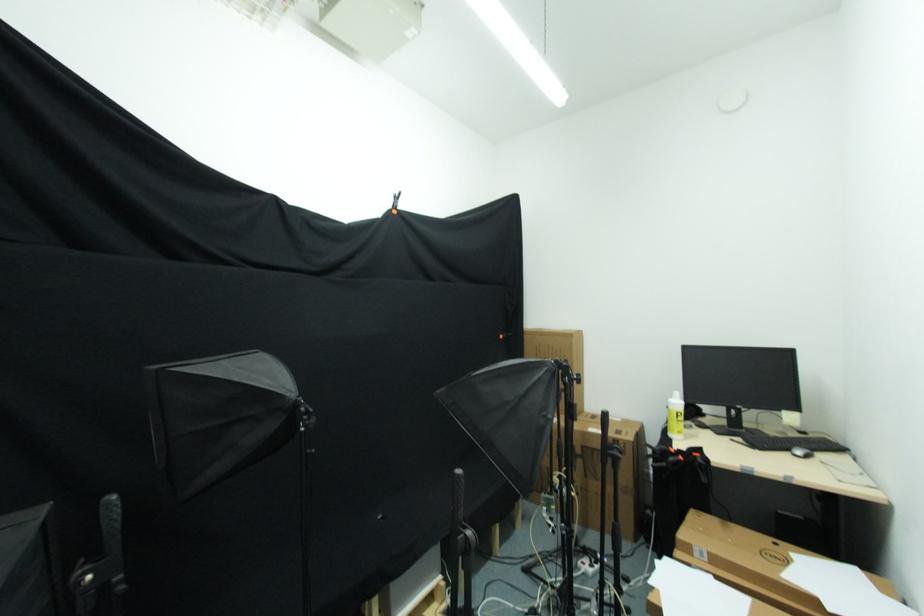
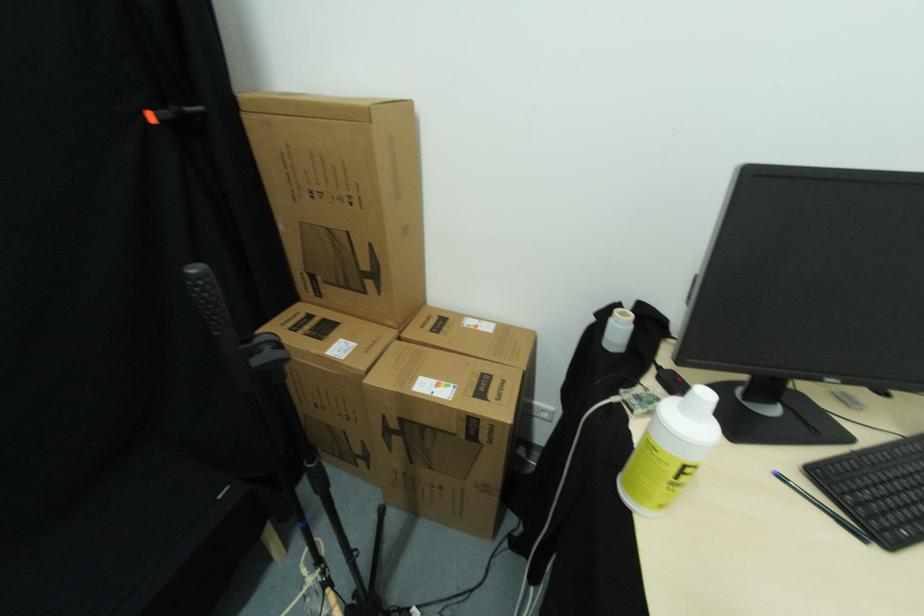
Find the pixel in the second image that matches (x=735, y=444) in the first image.

(784, 479)